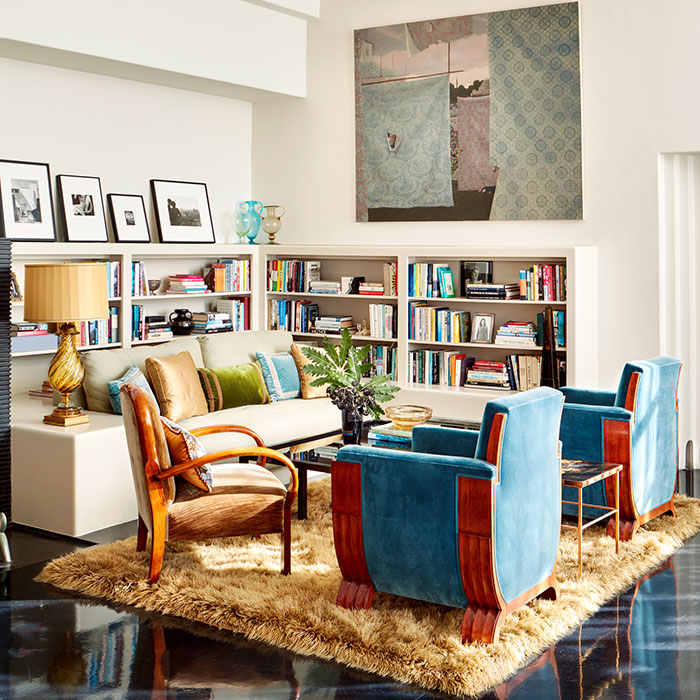
Identify the location of couch. (281, 399), (192, 421).